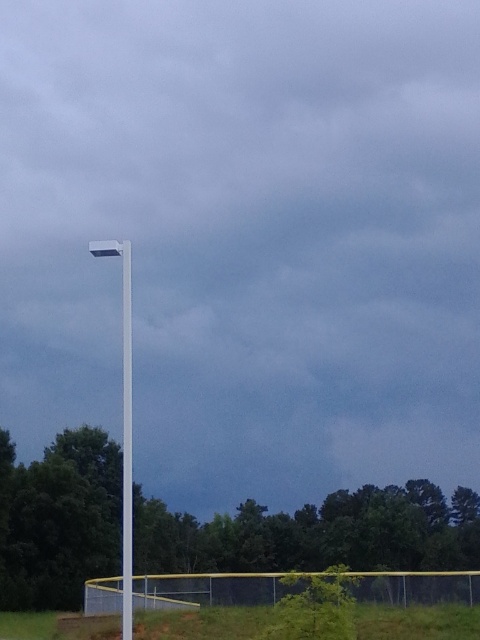
Does white smooth pole at upper left appear under white plastic pole at center?

Yes.

Is white smooth pole at upper left bigger than white plastic pole at center?

Yes.

What are the coordinates of `white smooth pole at upper left` in the screenshot? It's located at (123, 422).